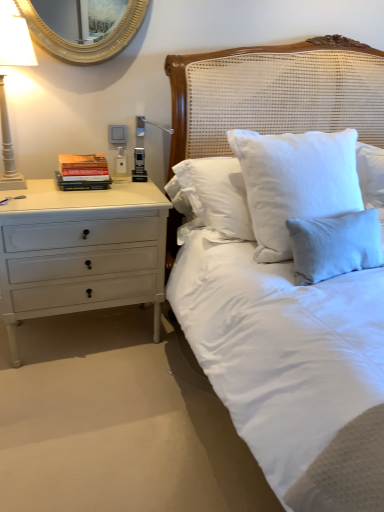
Question: Considering the relative sizes of light blue linen pillow at upper right and hardcover books at left in the image provided, is light blue linen pillow at upper right smaller than hardcover books at left?

Choices:
 (A) yes
 (B) no

Answer: (B)

Question: Are light blue linen pillow at upper right and hardcover books at left far apart?

Choices:
 (A) yes
 (B) no

Answer: (A)

Question: Can you confirm if light blue linen pillow at upper right is wider than hardcover books at left?

Choices:
 (A) no
 (B) yes

Answer: (A)

Question: From a real-world perspective, is light blue linen pillow at upper right located higher than hardcover books at left?

Choices:
 (A) no
 (B) yes

Answer: (A)

Question: From the image's perspective, is light blue linen pillow at upper right on top of hardcover books at left?

Choices:
 (A) yes
 (B) no

Answer: (B)

Question: Can you confirm if light blue linen pillow at upper right is shorter than hardcover books at left?

Choices:
 (A) no
 (B) yes

Answer: (A)

Question: Is white woven headboard at upper center completely or partially outside of light blue linen pillow at upper right?

Choices:
 (A) no
 (B) yes

Answer: (B)

Question: Does white woven headboard at upper center have a smaller size compared to light blue linen pillow at upper right?

Choices:
 (A) no
 (B) yes

Answer: (A)

Question: Can you confirm if white woven headboard at upper center is positioned to the left of light blue linen pillow at upper right?

Choices:
 (A) no
 (B) yes

Answer: (B)

Question: Does white woven headboard at upper center come in front of light blue linen pillow at upper right?

Choices:
 (A) yes
 (B) no

Answer: (B)

Question: Considering the relative positions of white woven headboard at upper center and light blue linen pillow at upper right in the image provided, is white woven headboard at upper center to the right of light blue linen pillow at upper right from the viewer's perspective?

Choices:
 (A) no
 (B) yes

Answer: (A)

Question: Would you consider white woven headboard at upper center to be distant from light blue linen pillow at upper right?

Choices:
 (A) yes
 (B) no

Answer: (B)

Question: Is white painted wood floor lamp at left thinner than light blue linen pillow at upper right?

Choices:
 (A) yes
 (B) no

Answer: (B)